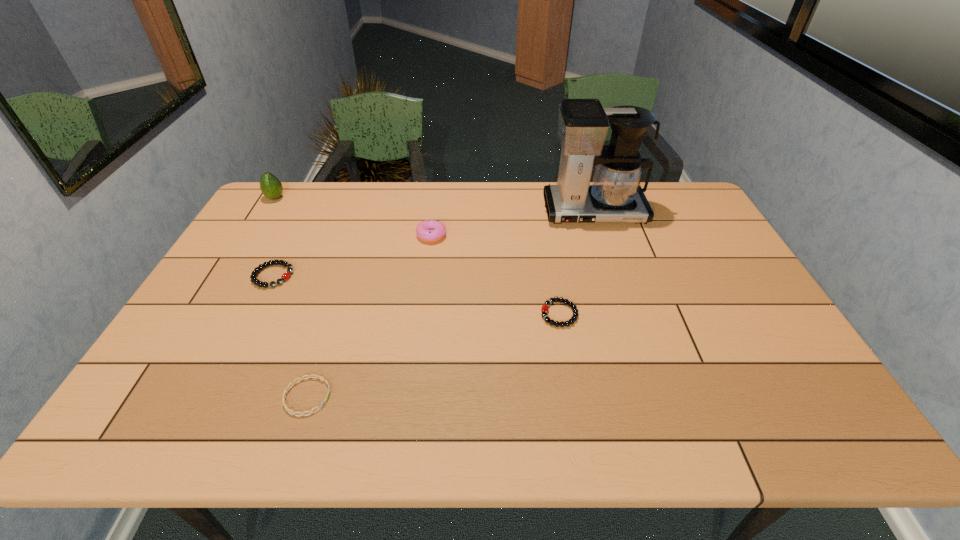
You are a GUI agent. You are given a task and a screenshot of the screen. Output one action in this format:
    pyautogui.click(x=<x>, y=<y>)
    Task: Click on the avocado that is at the left edge
    The width and height of the screenshot is (960, 540).
    Given the screenshot: What is the action you would take?
    pyautogui.click(x=271, y=187)

Identify the location of bracelet at the left edge. The image size is (960, 540). (286, 275).

Locate an element on the screen. Image resolution: width=960 pixels, height=540 pixels. object that is positioned at the far left corner is located at coordinates (271, 187).

Image resolution: width=960 pixels, height=540 pixels. Find the location of `vacant space at the far edge of the desktop`. vacant space at the far edge of the desktop is located at coordinates (323, 213).

I want to click on free space at the near edge, so click(x=576, y=440).

The height and width of the screenshot is (540, 960). I want to click on vacant space at the left edge of the desktop, so click(208, 288).

This screenshot has height=540, width=960. In the image, there is a desktop. Identify the location of vacant area at the far left corner. (300, 185).

The image size is (960, 540). I want to click on vacant region at the far right corner of the desktop, so click(x=678, y=200).

The width and height of the screenshot is (960, 540). Find the location of `free point between the avocado and the rightmost bracelet`. free point between the avocado and the rightmost bracelet is located at coordinates (418, 256).

Image resolution: width=960 pixels, height=540 pixels. I want to click on free space between the fifth object from right to left and the tallest object, so click(433, 244).